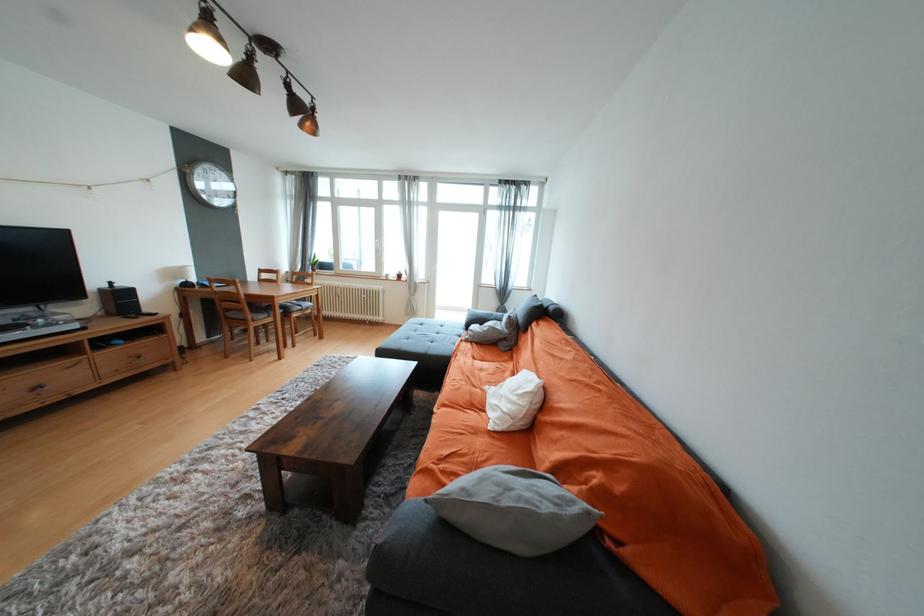
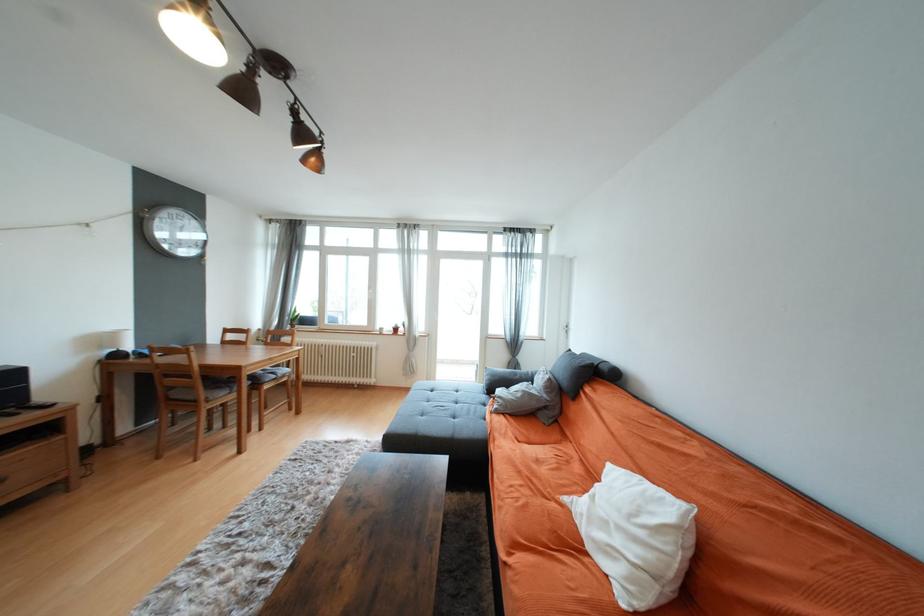
Find the pixel in the second image that matches pixel 451 339 in the first image.

(475, 411)